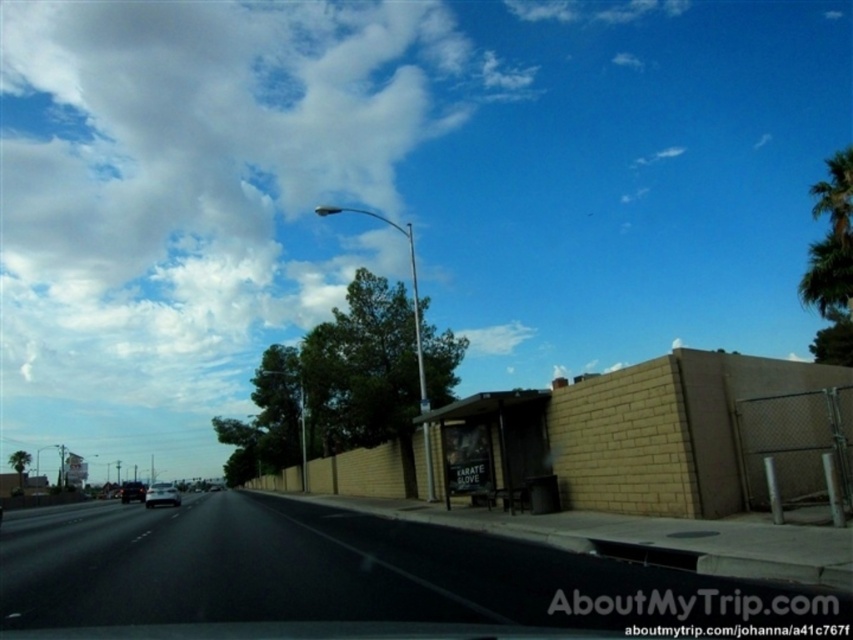
You are driving and looking out the window. You see two points marked on the road ahead. The first point is at coordinates point (x=177, y=502) and the second is at point (x=143, y=492). From your perspective inside the vehicle, which point is closer to you?

Point (x=177, y=502) is in front of point (x=143, y=492), so the point closer to you is point (x=177, y=502).

You are a passenger in a car and looking out the window. You see the black asphalt highway at center and the silver metallic car at center. Which object is higher from your viewpoint?

The black asphalt highway at center is located above the silver metallic car at center, so it is higher from your viewpoint.

You are a driver looking at the road ahead. Where is the black asphalt highway at center located in the image?

The black asphalt highway at center is located at point (357, 576) in the image.